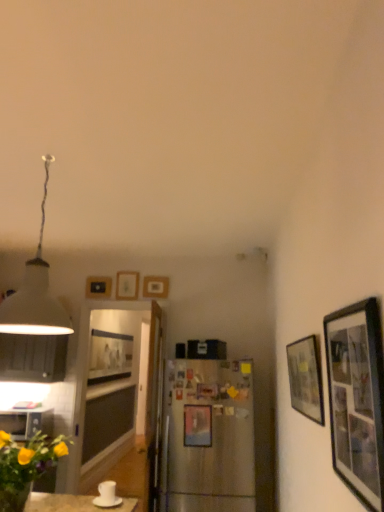
Question: Considering their positions, is matte black picture frame at right, which appears as the 7th picture frame when viewed from the left, located in front of or behind satin silver refrigerator at center?

Choices:
 (A) behind
 (B) front

Answer: (B)

Question: In terms of size, does matte black picture frame at right, which ranks as the 6th picture frame in back-to-front order, appear bigger or smaller than satin silver refrigerator at center?

Choices:
 (A) small
 (B) big

Answer: (B)

Question: Which object is the farthest from the metallic silver picture frame at center, the third picture frame in the right-to-left sequence?

Choices:
 (A) white glossy coffee cup at lower left
 (B) satin silver refrigerator at center
 (C) matte black picture frame at center, which appears as the 1th picture frame when viewed from the back
 (D) white matte lampshade at upper left
 (E) brushed metal microwave at lower left

Answer: (C)

Question: Which is farther from the matte black picture frame at right, the 1th picture frame in the right-to-left sequence?

Choices:
 (A) yellow matte flower at lower left
 (B) matte wood picture frame at upper center, the third picture frame viewed from the back
 (C) white matte lampshade at upper left
 (D) wooden picture frame at upper center, which is the fourth picture frame from right to left
 (E) white glossy coffee cup at lower left

Answer: (B)